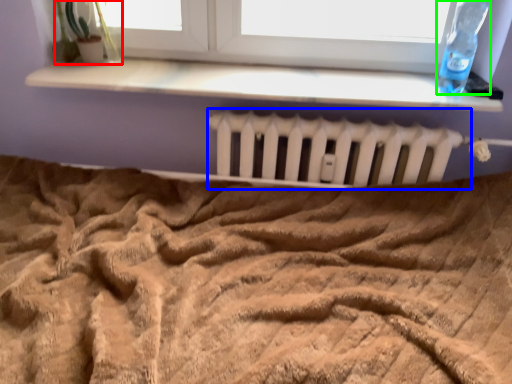
Question: Estimate the real-world distances between objects in this image. Which object is farther from plant (highlighted by a red box), radiator (highlighted by a blue box) or bottle (highlighted by a green box)?

Choices:
 (A) radiator
 (B) bottle

Answer: (B)